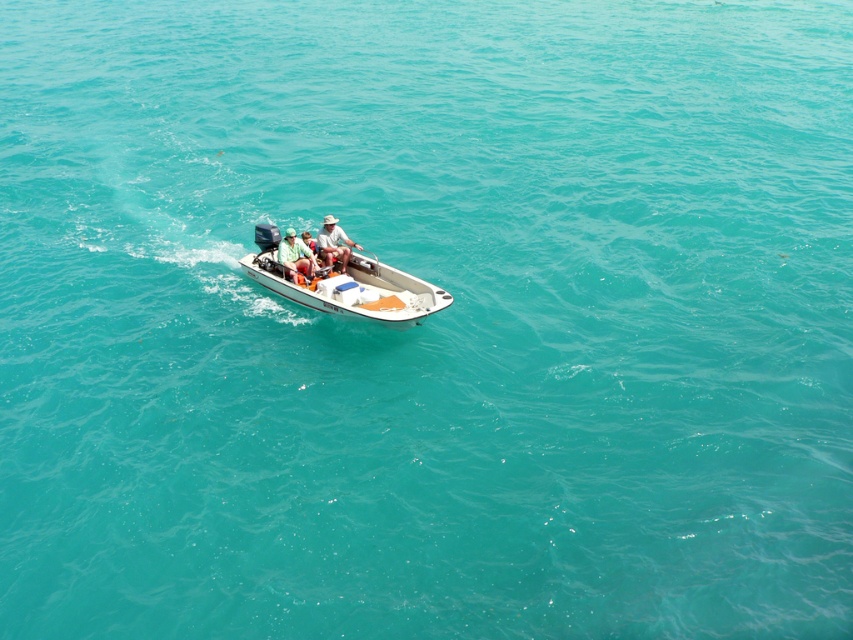
Question: Is white matte boat at center in front of tan woven hat at center?

Choices:
 (A) yes
 (B) no

Answer: (A)

Question: Which object is closer to the camera taking this photo?

Choices:
 (A) green fabric shirt at center
 (B) white matte boat at center

Answer: (B)

Question: Does tan woven hat at center appear under green fabric shirt at center?

Choices:
 (A) yes
 (B) no

Answer: (B)

Question: Which point appears closest to the camera in this image?

Choices:
 (A) (320, 237)
 (B) (305, 253)

Answer: (B)

Question: From the image, what is the correct spatial relationship of white matte boat at center in relation to tan woven hat at center?

Choices:
 (A) above
 (B) below

Answer: (B)

Question: Which point appears closest to the camera in this image?

Choices:
 (A) (274, 257)
 (B) (329, 218)

Answer: (B)